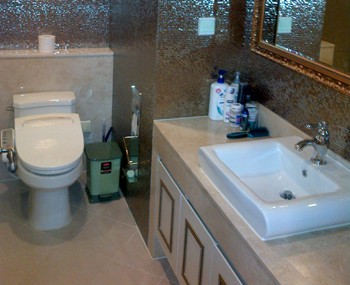
You are a GUI agent. You are given a task and a screenshot of the screen. Output one action in this format:
    pyautogui.click(x=<x>, y=<y>)
    Task: Click on the faucet
    The image size is (350, 285).
    Given the screenshot: What is the action you would take?
    pyautogui.click(x=316, y=146)